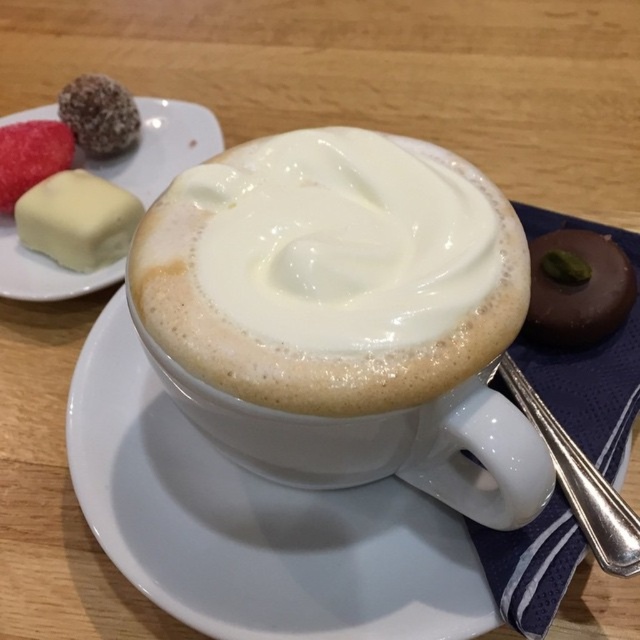
Question: Does white frothy coffee at center appear under white cream cheese at upper left?

Choices:
 (A) no
 (B) yes

Answer: (B)

Question: Does white frothy coffee at center appear on the left side of white creamy cube at upper left?

Choices:
 (A) no
 (B) yes

Answer: (A)

Question: Which object is positioned farthest from the chocolatesmoothchocolate at right?

Choices:
 (A) white creamy cube at upper left
 (B) white frothy coffee at center

Answer: (A)

Question: Which of the following is the farthest from the observer?

Choices:
 (A) (304, 292)
 (B) (620, 298)
 (C) (173, 572)

Answer: (B)

Question: Is white frothy coffee at center above white ceramic saucer at center?

Choices:
 (A) yes
 (B) no

Answer: (A)

Question: Which of the following is the farthest from the observer?

Choices:
 (A) (70, 188)
 (B) (330, 544)
 (C) (45, 131)

Answer: (C)